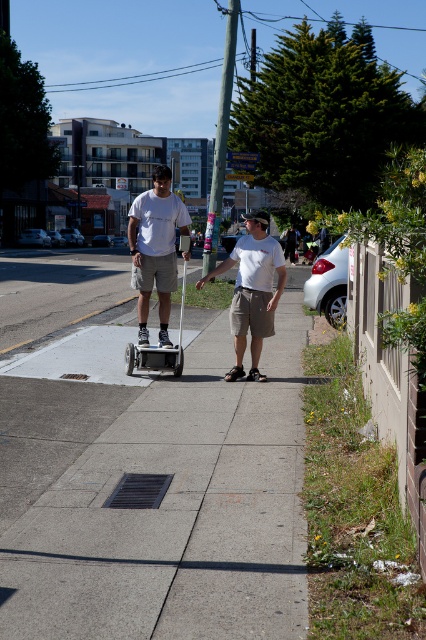
Question: Can you confirm if matte white shirt at center is positioned above white matte t-shirt at center?

Choices:
 (A) yes
 (B) no

Answer: (A)

Question: Can you confirm if concrete sidewalk at center is wider than white matte t-shirt at center?

Choices:
 (A) no
 (B) yes

Answer: (B)

Question: Which object is the closest to the matte white shirt at center?

Choices:
 (A) concrete sidewalk at center
 (B) white matte t-shirt at center

Answer: (B)

Question: Does matte white shirt at center appear under white matte t-shirt at center?

Choices:
 (A) no
 (B) yes

Answer: (A)

Question: Based on their relative distances, which object is nearer to the matte white shirt at center?

Choices:
 (A) white matte t-shirt at center
 (B) concrete sidewalk at center

Answer: (A)

Question: Among these objects, which one is nearest to the camera?

Choices:
 (A) concrete sidewalk at center
 (B) white matte t-shirt at center
 (C) matte white shirt at center

Answer: (A)